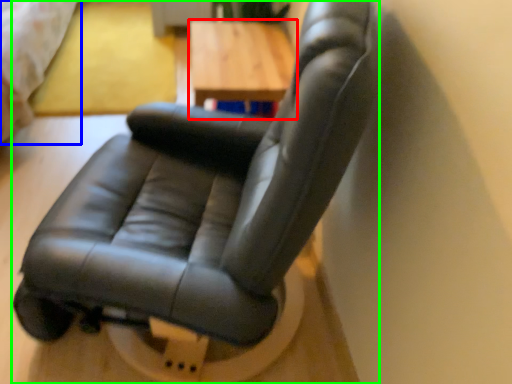
Question: Based on their relative distances, which object is nearer to table (highlighted by a red box)? Choose from bed (highlighted by a blue box) and chair (highlighted by a green box).

Choices:
 (A) bed
 (B) chair

Answer: (B)